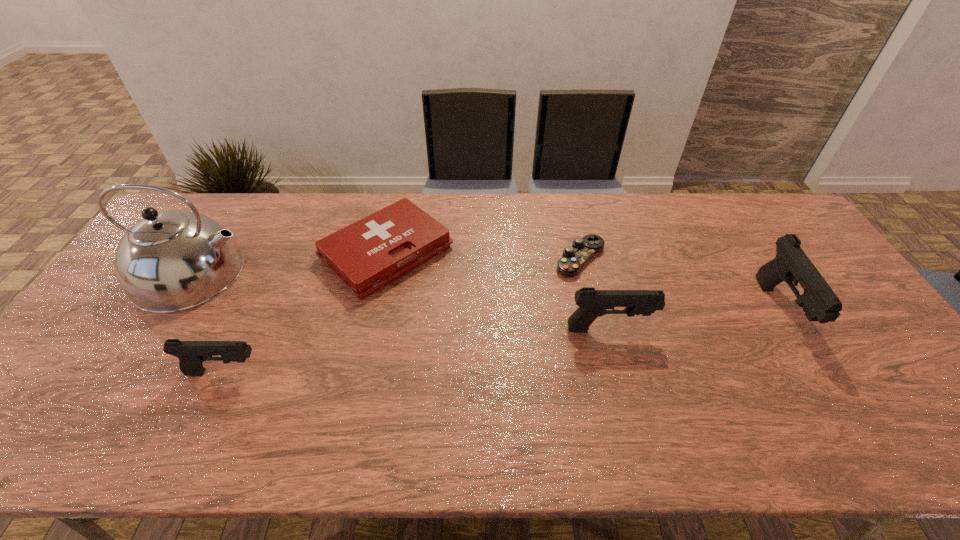
Locate an element on the screen. This screenshot has width=960, height=540. vacant space at the left edge of the desktop is located at coordinates (99, 363).

You are a GUI agent. You are given a task and a screenshot of the screen. Output one action in this format:
    pyautogui.click(x=<x>, y=<y>)
    Task: Click on the free spot between the leftmost pistol and the kettle
    
    Given the screenshot: What is the action you would take?
    pyautogui.click(x=209, y=323)

You are a GUI agent. You are given a task and a screenshot of the screen. Output one action in this format:
    pyautogui.click(x=<x>, y=<y>)
    Task: Click on the vacant area that lies between the rightmost object and the control
    The image size is (960, 540).
    Given the screenshot: What is the action you would take?
    pyautogui.click(x=680, y=284)

Where is `empty space between the tallest object and the rightmost object`? empty space between the tallest object and the rightmost object is located at coordinates (487, 292).

Locate an element on the screen. The width and height of the screenshot is (960, 540). blank region between the shortest object and the nearest object is located at coordinates (402, 315).

What are the coordinates of `free space that is in between the rightmost pistol and the nearest pistol` in the screenshot? It's located at (502, 341).

Locate an element on the screen. empty space that is in between the control and the leftmost pistol is located at coordinates (402, 315).

Find the location of a particular element. This screenshot has width=960, height=540. object that stands as the fifth closest to the rightmost pistol is located at coordinates (171, 261).

Select which object appears as the second closest to the second shortest pistol. Please provide its 2D coordinates. Your answer should be formatted as a tuple, i.e. [(x, y)], where the tuple contains the x and y coordinates of a point satisfying the conditions above.

[(367, 255)]

In order to click on pistol that is the second closest to the first-aid kit in this screenshot , I will do `click(592, 303)`.